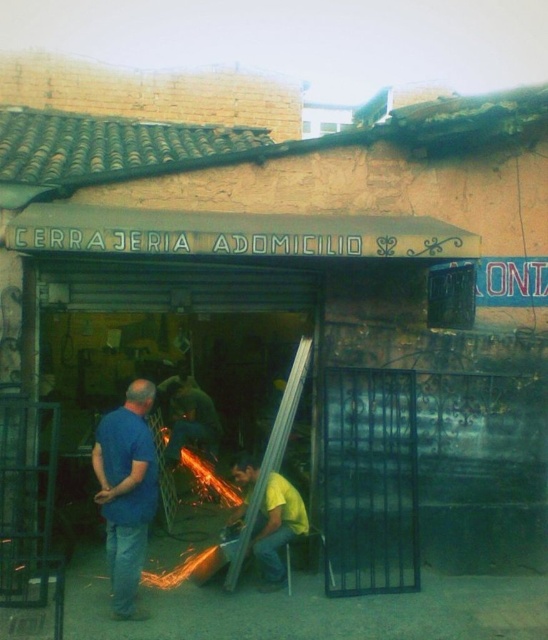
Who is positioned more to the right, yellow matte shirt at center or green fabric shirt at center?

From the viewer's perspective, yellow matte shirt at center appears more on the right side.

Which is in front, point (262, 508) or point (180, 435)?

Point (262, 508) is more forward.

Find the location of a particular element. This screenshot has width=548, height=640. yellow matte shirt at center is located at coordinates (276, 529).

The height and width of the screenshot is (640, 548). What are the coordinates of `blue matte shirt at center` in the screenshot? It's located at (127, 490).

Consider the image. Does blue matte shirt at center have a greater width compared to green fabric shirt at center?

No, blue matte shirt at center is not wider than green fabric shirt at center.

Identify the location of blue matte shirt at center. (127, 490).

Locate an element on the screen. blue matte shirt at center is located at coordinates 127,490.

Between point (142, 512) and point (272, 573), which one is positioned in front?

Point (142, 512)

At what (x,y) coordinates should I click in order to perform the action: click on blue matte shirt at center. Please return your answer as a coordinate pair (x, y). Looking at the image, I should click on (127, 490).